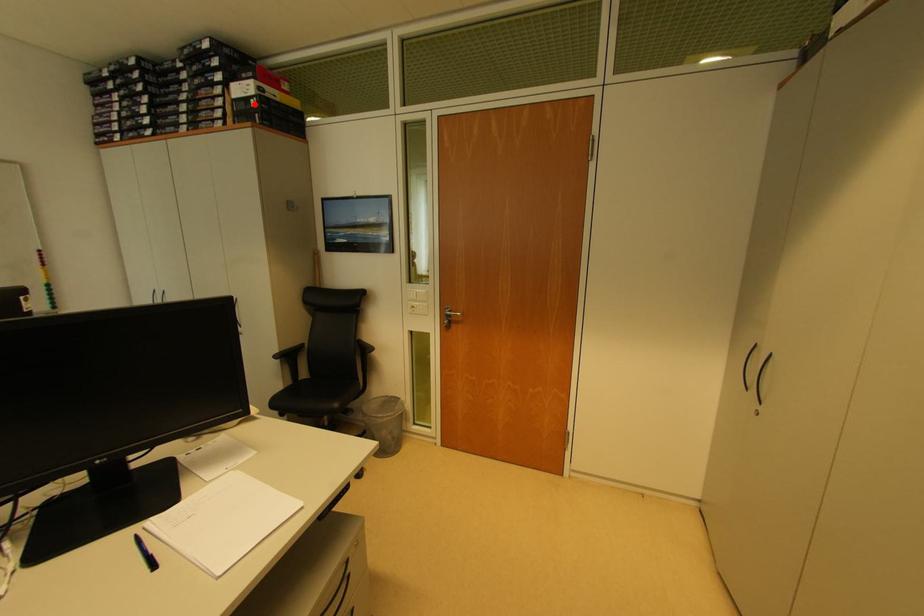
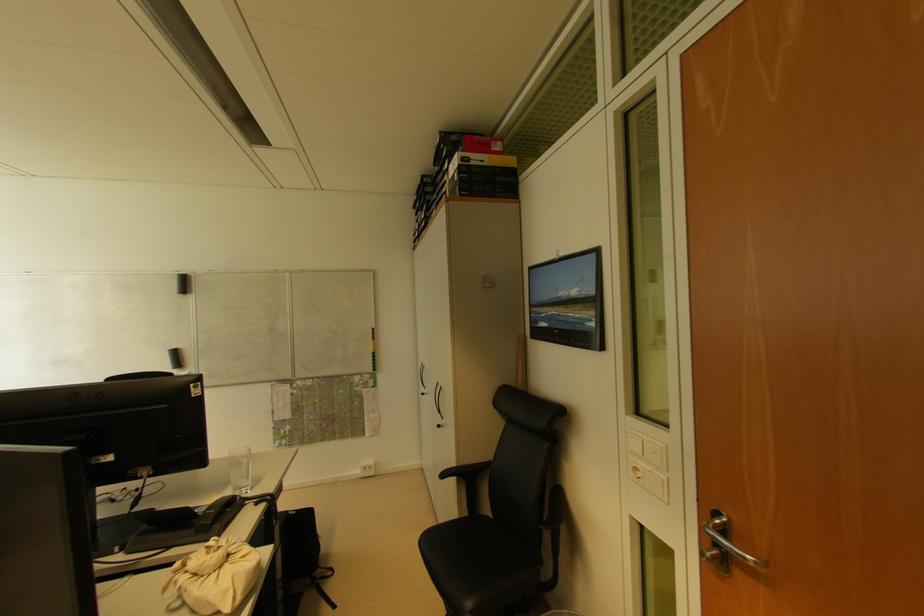
In the second image, find the point that corresponds to the highlighted location in the first image.

(457, 177)